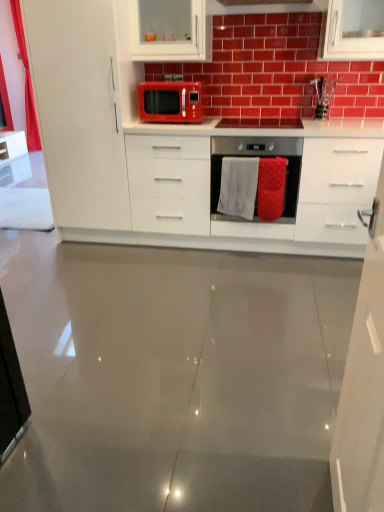
Question: In terms of size, does white glossy cabinet at left, which appears as the 2th cabinetry when viewed from the back, appear bigger or smaller than red textured towel at center?

Choices:
 (A) small
 (B) big

Answer: (B)

Question: From the image's perspective, is white glossy cabinet at left, positioned as the 1th cabinetry in left-to-right order, located above or below red textured towel at center?

Choices:
 (A) below
 (B) above

Answer: (B)

Question: Estimate the real-world distances between objects in this image. Which object is closer to the white towel at center?

Choices:
 (A) white glossy countertop at center
 (B) white glossy cabinet at upper right, placed as the 3th cabinetry when sorted from back to front
 (C) matte red microwave at center
 (D) red textured towel at center
 (E) stainless steel oven at center

Answer: (E)

Question: Estimate the real-world distances between objects in this image. Which object is closer to the stainless steel oven at center?

Choices:
 (A) white glossy cabinet at upper right, placed as the 3th cabinetry when sorted from back to front
 (B) matte red microwave at center
 (C) white glossy cabinet at upper center, which ranks as the 1th cabinetry in back-to-front order
 (D) white glossy countertop at center
 (E) red textured towel at center

Answer: (E)